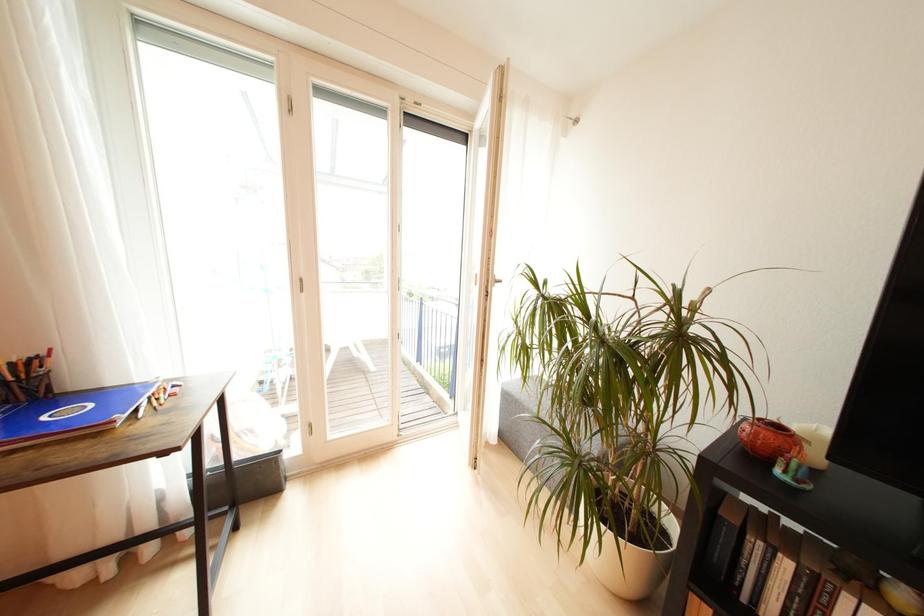
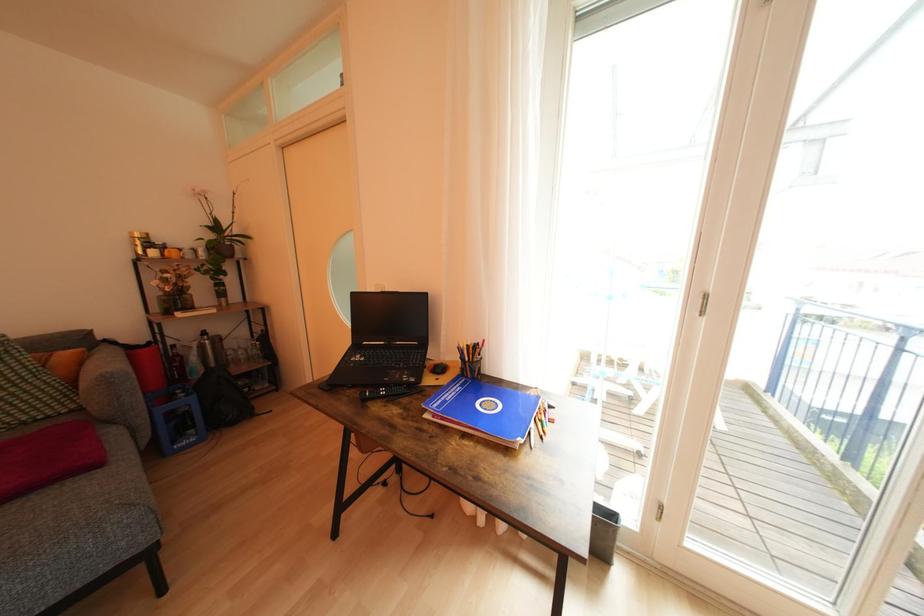
Question: Based on the continuous images, in which direction is the camera rotating? Reply with the corresponding letter.

Choices:
 (A) Left
 (B) Right
 (C) Up
 (D) Down

Answer: (A)